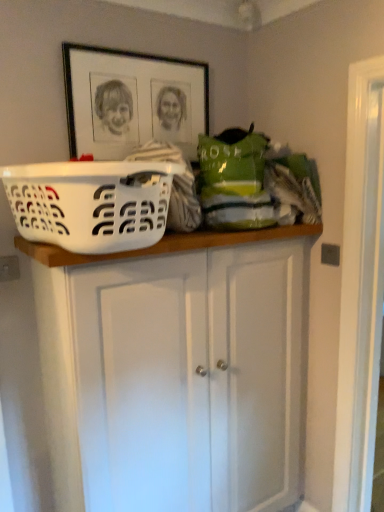
Question: Is white painted wood cabinet at upper center not close to white plastic laundry basket at upper center?

Choices:
 (A) no
 (B) yes

Answer: (A)

Question: Is white painted wood cabinet at upper center shorter than white plastic laundry basket at upper center?

Choices:
 (A) no
 (B) yes

Answer: (A)

Question: Is white painted wood cabinet at upper center taller than white plastic laundry basket at upper center?

Choices:
 (A) no
 (B) yes

Answer: (B)

Question: From the image's perspective, is white painted wood cabinet at upper center over white plastic laundry basket at upper center?

Choices:
 (A) yes
 (B) no

Answer: (B)

Question: Is white painted wood cabinet at upper center in contact with white plastic laundry basket at upper center?

Choices:
 (A) yes
 (B) no

Answer: (B)

Question: Is white painted wood cabinet at upper center turned away from white plastic laundry basket at upper center?

Choices:
 (A) no
 (B) yes

Answer: (A)

Question: Is black matte picture frame at upper center outside of white plastic laundry basket at upper center?

Choices:
 (A) yes
 (B) no

Answer: (A)

Question: From the image's perspective, is black matte picture frame at upper center under white plastic laundry basket at upper center?

Choices:
 (A) yes
 (B) no

Answer: (B)

Question: Could you tell me if black matte picture frame at upper center is facing white plastic laundry basket at upper center?

Choices:
 (A) no
 (B) yes

Answer: (A)

Question: Does black matte picture frame at upper center come behind white plastic laundry basket at upper center?

Choices:
 (A) yes
 (B) no

Answer: (A)

Question: Is there a large distance between black matte picture frame at upper center and white plastic laundry basket at upper center?

Choices:
 (A) yes
 (B) no

Answer: (B)

Question: Is black matte picture frame at upper center directly adjacent to white plastic laundry basket at upper center?

Choices:
 (A) no
 (B) yes

Answer: (A)

Question: Can you confirm if white plastic laundry basket at upper center is shorter than white painted wood cabinet at upper center?

Choices:
 (A) no
 (B) yes

Answer: (B)